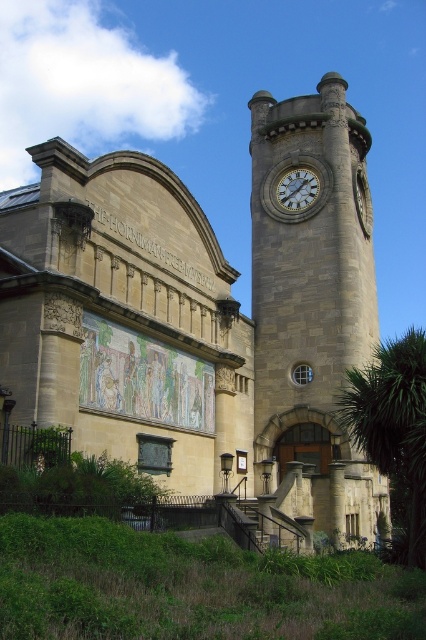
This screenshot has height=640, width=426. What do you see at coordinates (313, 305) in the screenshot? I see `stone clock tower at center` at bounding box center [313, 305].

This screenshot has height=640, width=426. What are the coordinates of `stone clock tower at center` in the screenshot? It's located at (313, 305).